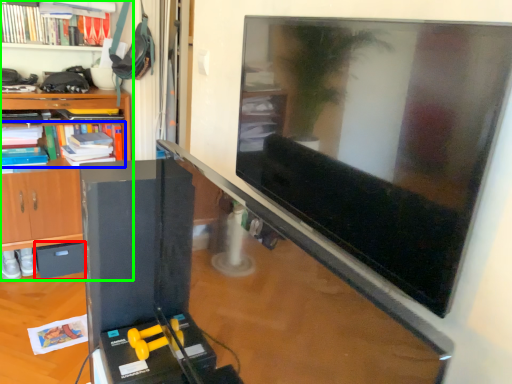
Question: Which is nearer to the drawer (highlighted by a red box)? book (highlighted by a blue box) or shelf (highlighted by a green box).

Choices:
 (A) book
 (B) shelf

Answer: (B)